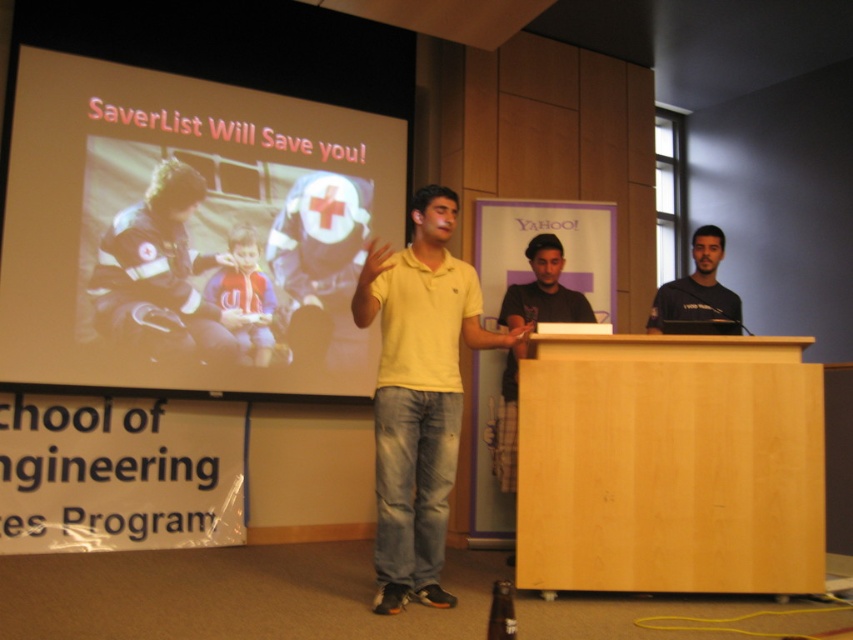
You are an attendee sitting in the conference room and want to take a photo of the slide displayed on the matte plastic projector screen at upper left. However, you notice that the screen is at a specific coordinate point. Can you confirm if the screen is positioned at point (189, 230)?

The matte plastic projector screen at upper left is indeed represented by point (189, 230).